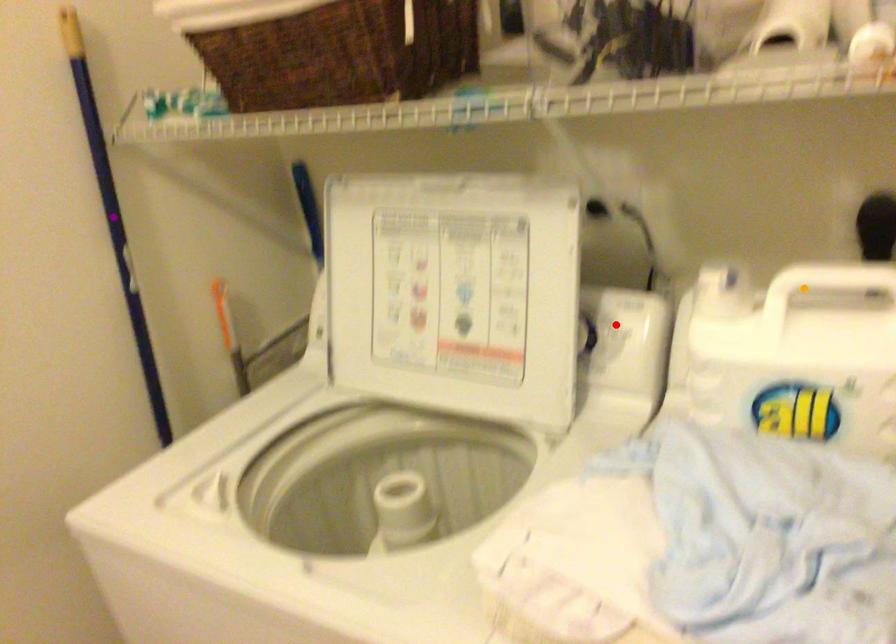
Order these from nearest to farthest:
A) orange point
B) red point
C) purple point

orange point → red point → purple point